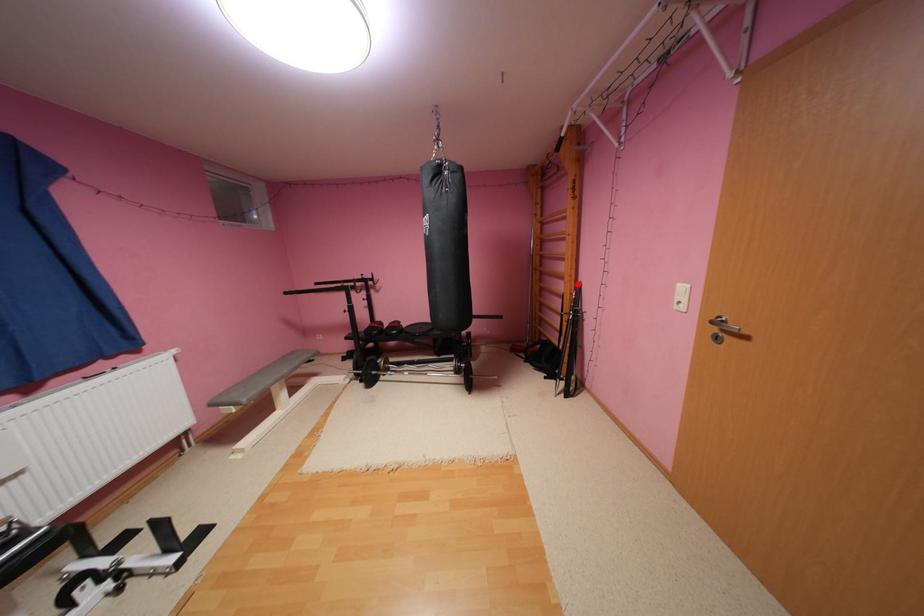
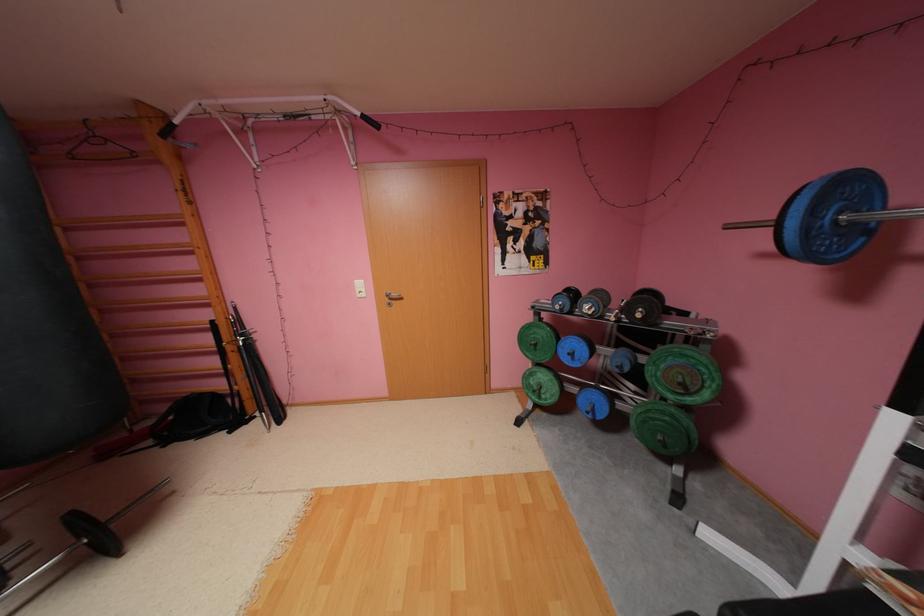
Where in the second image is the point corresponding to the highlighted location from the first image?

(227, 308)